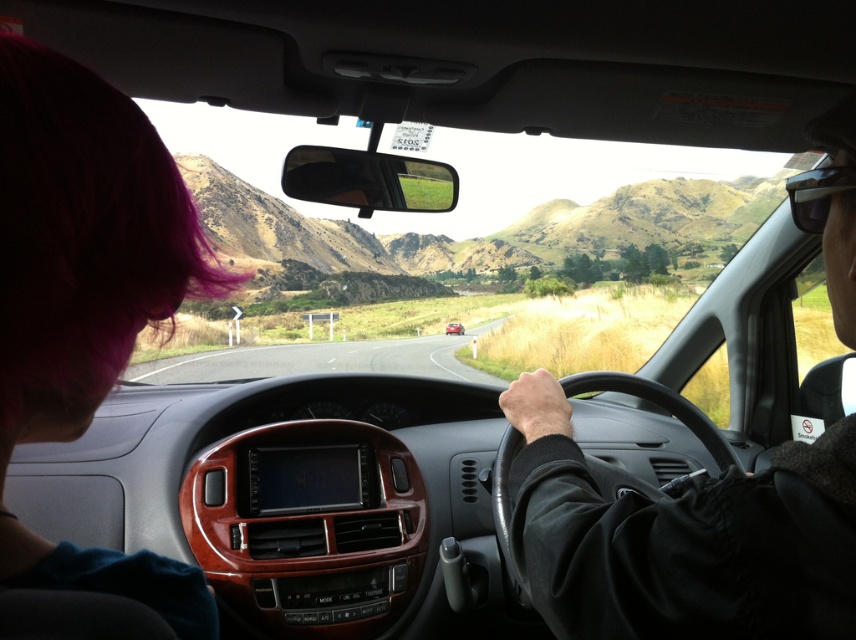
Is black leather jacket at center thinner than metallic red car at center?

Correct, black leather jacket at center's width is less than metallic red car at center's.

Does point (789, 609) come closer to viewer compared to point (452, 323)?

Yes, it is.

Between point (508, 401) and point (455, 323), which one is positioned behind?

The point (455, 323) is more distant.

Find the location of `black leather jacket at center`. black leather jacket at center is located at coordinates (682, 540).

Is pink hair at left positioned before metallic red car at center?

Yes, it is in front of metallic red car at center.

Who is positioned more to the right, pink hair at left or metallic red car at center?

Positioned to the right is metallic red car at center.

Identify the location of pink hair at left. (86, 296).

Based on the photo, which of these two, pink hair at left or black leather jacket at center, stands taller?

black leather jacket at center is taller.

Is the position of pink hair at left more distant than that of black leather jacket at center?

No, pink hair at left is closer to the viewer.

At what (x,y) coordinates should I click in order to perform the action: click on pink hair at left. Please return your answer as a coordinate pair (x, y). Looking at the image, I should click on pyautogui.click(x=86, y=296).